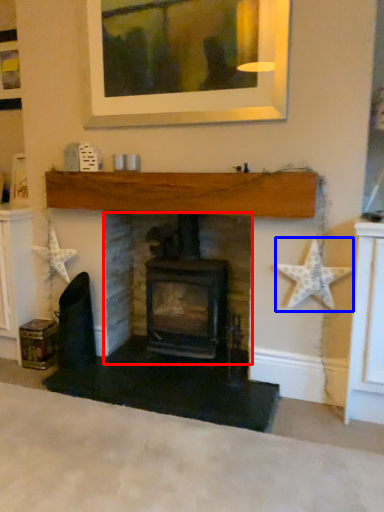
Question: Among these objects, which one is farthest to the camera, fireplace (highlighted by a red box) or starfish (highlighted by a blue box)?

Choices:
 (A) fireplace
 (B) starfish

Answer: (A)